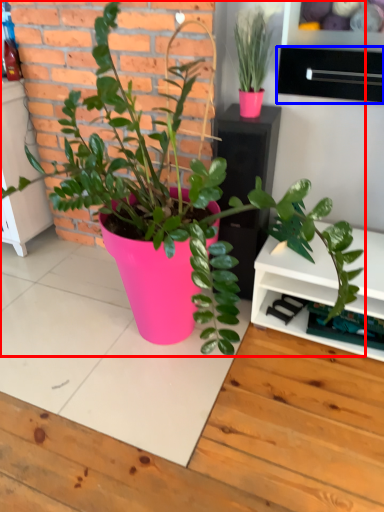
Question: Which point is closer to the camera, houseplant (highlighted by a red box) or drawer (highlighted by a blue box)?

Choices:
 (A) houseplant
 (B) drawer

Answer: (A)